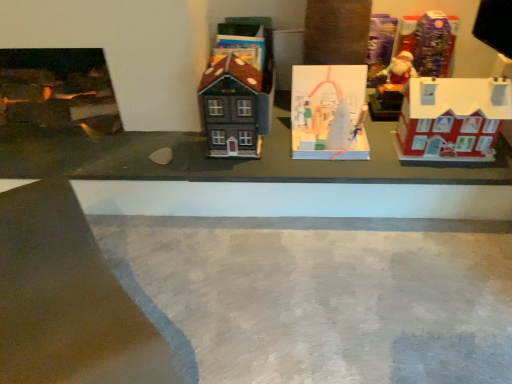
Identify the location of vacant space situated on the left part of matte brown house at center, placed as the fifth toy when sorted from right to left. (192, 146).